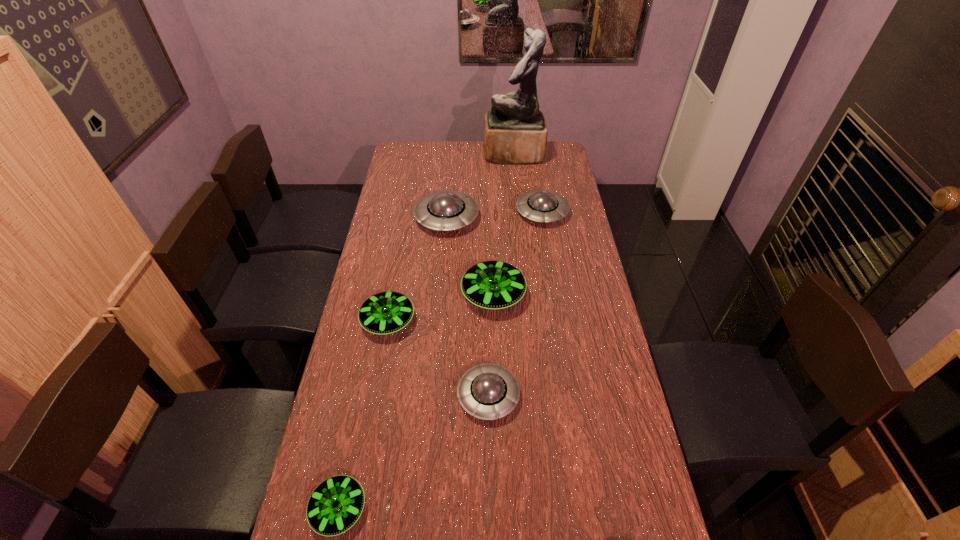
Locate an element on the screen. vacant space located in a relaxed pose on the tallest object is located at coordinates (455, 153).

Identify the location of free space located on the back of the biggest gray saucer. The image size is (960, 540). (451, 165).

In order to click on free spot located 0.220m on the left of the biggest green saucer in this screenshot , I will do `click(399, 295)`.

This screenshot has width=960, height=540. Identify the location of free spot located on the left of the second biggest gray saucer. (494, 213).

This screenshot has width=960, height=540. Identify the location of free space located on the front of the second biggest green saucer. (372, 413).

Where is `free region located on the back of the nearest gray saucer`? This screenshot has width=960, height=540. free region located on the back of the nearest gray saucer is located at coordinates (488, 353).

The width and height of the screenshot is (960, 540). Identify the location of object at the far edge. (515, 132).

Where is `sculpture that is at the right edge`? Image resolution: width=960 pixels, height=540 pixels. sculpture that is at the right edge is located at coordinates (515, 132).

Where is `saucer present at the right edge`? saucer present at the right edge is located at coordinates (538, 205).

Locate an element on the screen. The width and height of the screenshot is (960, 540). object that is positioned at the far right corner is located at coordinates (515, 132).